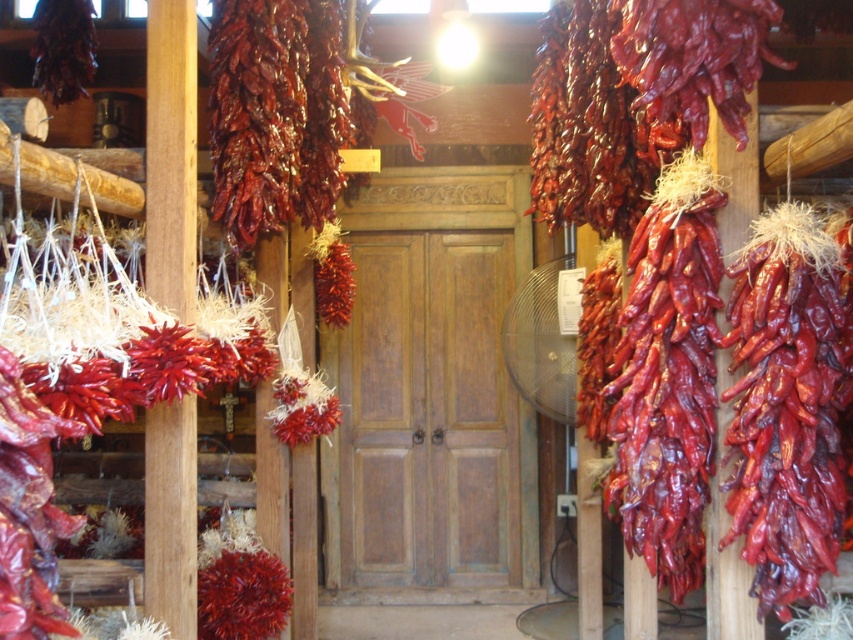
Does dried red pepper at center appear on the left side of wooden post at left?

No, dried red pepper at center is not to the left of wooden post at left.

This screenshot has height=640, width=853. Describe the element at coordinates (276, 113) in the screenshot. I see `dried red pepper at center` at that location.

You are a GUI agent. You are given a task and a screenshot of the screen. Output one action in this format:
    pyautogui.click(x=<x>, y=<y>)
    Task: Click on the dried red pepper at center
    The height and width of the screenshot is (640, 853).
    Given the screenshot: What is the action you would take?
    pyautogui.click(x=276, y=113)

Describe the element at coordinates (786, 404) in the screenshot. I see `dried red pepper at right` at that location.

Does dried red pepper at right come in front of wooden post at left?

Yes, dried red pepper at right is closer to the viewer.

Measure the distance between dried red pepper at right and camera.

dried red pepper at right is 7.06 feet away from camera.

What are the coordinates of `dried red pepper at right` in the screenshot? It's located at (786, 404).

Who is lower down, dried red pepper at right or dried red pepper at center?

Positioned lower is dried red pepper at right.

Can you confirm if dried red pepper at right is positioned above dried red pepper at center?

No.

Between point (740, 529) and point (287, 189), which one is positioned in front?

Positioned in front is point (740, 529).

What are the coordinates of `dried red pepper at right` in the screenshot? It's located at (786, 404).